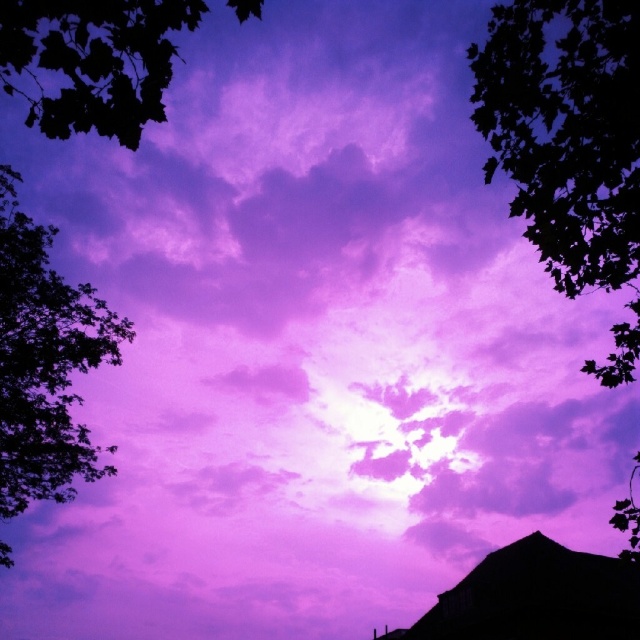
Can you confirm if green leafy tree at upper left is thinner than silhouette wooden hut at bottom right?

No.

Between point (129, 35) and point (532, 598), which one is positioned in front?

Point (129, 35) is in front.

Who is more distant from viewer, (x=26, y=26) or (x=456, y=584)?

Point (x=456, y=584)

Find the location of a particular element. green leafy tree at upper left is located at coordinates pyautogui.click(x=92, y=61).

Which is above, dark green leafy tree at left or silhouette wooden hut at bottom right?

dark green leafy tree at left is above.

Does dark green leafy tree at left have a greater width compared to silhouette wooden hut at bottom right?

No.

Is point (8, 182) more distant than point (611, 592)?

No.

You are a GUI agent. You are given a task and a screenshot of the screen. Output one action in this format:
    pyautogui.click(x=<x>, y=<y>)
    Task: Click on the dark green leafy tree at left
    This screenshot has height=640, width=640.
    Given the screenshot: What is the action you would take?
    pyautogui.click(x=44, y=362)

Which is below, dark green leafy tree at upper right or dark green leafy tree at left?

dark green leafy tree at left

Consider the image. Who is positioned more to the left, dark green leafy tree at upper right or dark green leafy tree at left?

dark green leafy tree at left

Find the location of `dark green leafy tree at upper right`. dark green leafy tree at upper right is located at coordinates (570, 145).